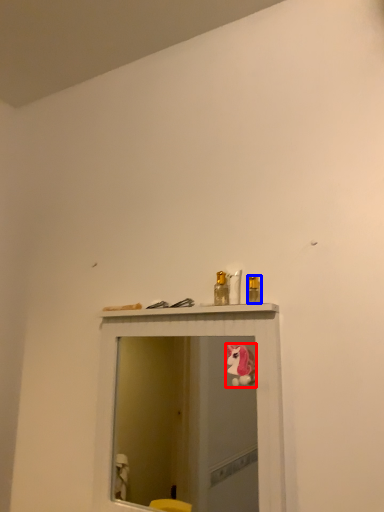
Question: Which point is further to the camera, animal (highlighted by a red box) or toiletry (highlighted by a blue box)?

Choices:
 (A) animal
 (B) toiletry

Answer: (B)